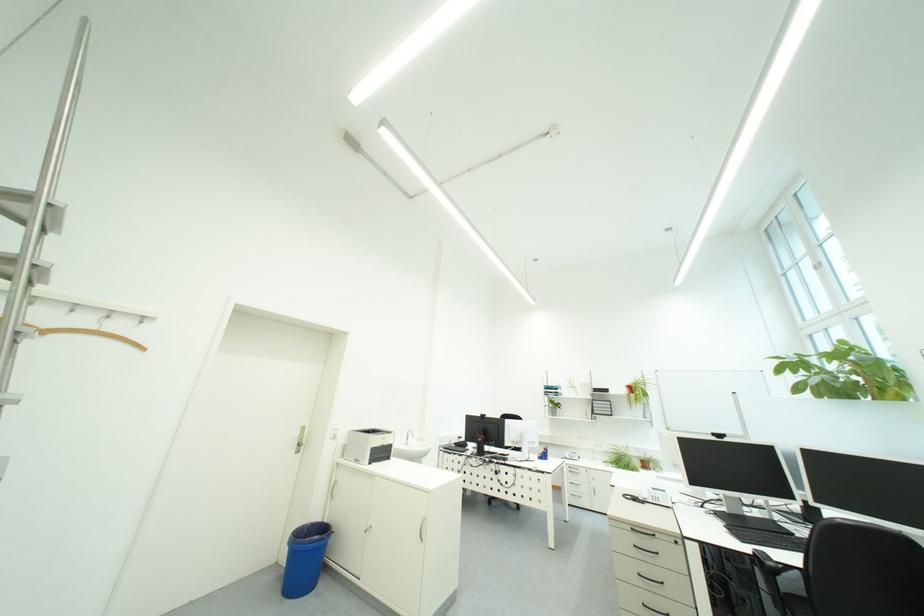
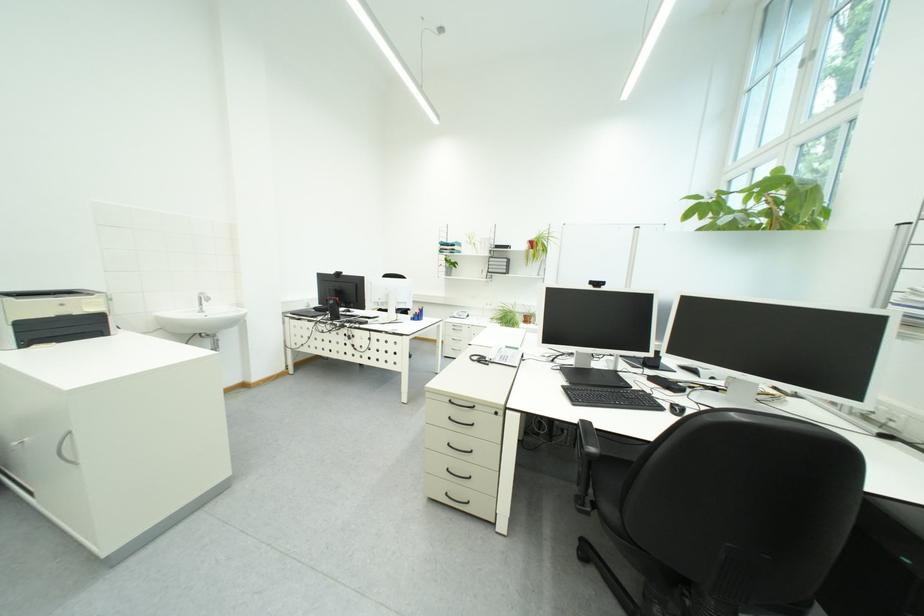
The point at [647,501] is marked in the first image. Where is the corresponding point in the second image?

(492, 362)